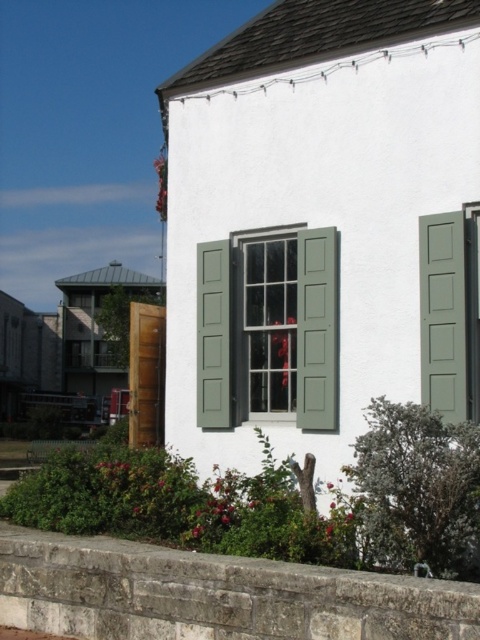
You are standing in front of the building and notice the gray stone curb at lower left and the green matte window at center. Which object is positioned to the right of the other?

The gray stone curb at lower left is to the right of the green matte window at center.